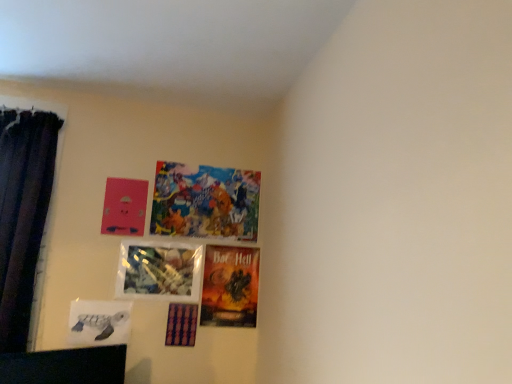
Question: Is matte cardboard poster at center, positioned as the 3th picture frame in bottom-to-top order, taller than matte pink picture frame at upper left, placed as the fifth picture frame when sorted from bottom to top?

Choices:
 (A) no
 (B) yes

Answer: (B)

Question: Is matte cardboard poster at center, which is the 4th picture frame in top-to-bottom order, outside of matte pink picture frame at upper left, placed as the fifth picture frame when sorted from bottom to top?

Choices:
 (A) no
 (B) yes

Answer: (B)

Question: From the image's perspective, is matte cardboard poster at center, positioned as the 3th picture frame in bottom-to-top order, above matte pink picture frame at upper left, acting as the second picture frame starting from the top?

Choices:
 (A) no
 (B) yes

Answer: (A)

Question: From the image's perspective, does matte cardboard poster at center, which is the 4th picture frame in top-to-bottom order, appear lower than matte pink picture frame at upper left, acting as the second picture frame starting from the top?

Choices:
 (A) no
 (B) yes

Answer: (B)

Question: Is matte cardboard poster at center, positioned as the 3th picture frame in bottom-to-top order, far away from matte pink picture frame at upper left, acting as the second picture frame starting from the top?

Choices:
 (A) yes
 (B) no

Answer: (B)

Question: From the image's perspective, is matte cardboard poster at center, positioned as the 3th picture frame in bottom-to-top order, located above or below matte white turtle at lower left, which ranks as the second picture frame in bottom-to-top order?

Choices:
 (A) below
 (B) above

Answer: (B)

Question: Considering their positions, is matte cardboard poster at center, which is the 4th picture frame in top-to-bottom order, located in front of or behind matte white turtle at lower left, positioned as the fifth picture frame in top-to-bottom order?

Choices:
 (A) front
 (B) behind

Answer: (B)

Question: Is matte cardboard poster at center, positioned as the 3th picture frame in bottom-to-top order, bigger or smaller than matte white turtle at lower left, which ranks as the second picture frame in bottom-to-top order?

Choices:
 (A) big
 (B) small

Answer: (A)

Question: From their relative heights in the image, would you say matte cardboard poster at center, which is the 4th picture frame in top-to-bottom order, is taller or shorter than matte white turtle at lower left, which ranks as the second picture frame in bottom-to-top order?

Choices:
 (A) short
 (B) tall

Answer: (B)

Question: Is matte cardboard poster at center, which is the 4th picture frame in top-to-bottom order, wider or thinner than matte pink picture frame at upper left, placed as the fifth picture frame when sorted from bottom to top?

Choices:
 (A) thin
 (B) wide

Answer: (B)

Question: Is matte cardboard poster at center, positioned as the 3th picture frame in bottom-to-top order, to the left or to the right of matte pink picture frame at upper left, placed as the fifth picture frame when sorted from bottom to top, in the image?

Choices:
 (A) right
 (B) left

Answer: (A)

Question: From a real-world perspective, is matte cardboard poster at center, positioned as the 3th picture frame in bottom-to-top order, physically located above or below matte pink picture frame at upper left, acting as the second picture frame starting from the top?

Choices:
 (A) above
 (B) below

Answer: (B)

Question: Is matte cardboard poster at center, which is the 4th picture frame in top-to-bottom order, taller or shorter than matte pink picture frame at upper left, placed as the fifth picture frame when sorted from bottom to top?

Choices:
 (A) short
 (B) tall

Answer: (B)

Question: Considering their positions, is matte cardboard poster at center, which is the 4th picture frame in top-to-bottom order, located in front of or behind dark velvet curtain at left?

Choices:
 (A) front
 (B) behind

Answer: (B)

Question: Is point (214, 256) closer or farther from the camera than point (5, 114)?

Choices:
 (A) closer
 (B) farther

Answer: (B)